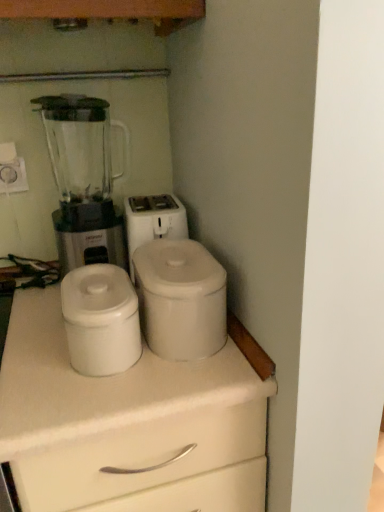
Question: Considering the relative sizes of white matte chest of drawers at center and transparent plastic blender at left in the image provided, is white matte chest of drawers at center thinner than transparent plastic blender at left?

Choices:
 (A) no
 (B) yes

Answer: (A)

Question: From a real-world perspective, is white matte chest of drawers at center positioned under transparent plastic blender at left based on gravity?

Choices:
 (A) no
 (B) yes

Answer: (B)

Question: Is transparent plastic blender at left located within white matte chest of drawers at center?

Choices:
 (A) no
 (B) yes

Answer: (A)

Question: Does white matte chest of drawers at center appear on the right side of transparent plastic blender at left?

Choices:
 (A) no
 (B) yes

Answer: (B)

Question: Is white matte chest of drawers at center bigger than transparent plastic blender at left?

Choices:
 (A) yes
 (B) no

Answer: (A)

Question: Is white matte container at center, which is the first appliance from left to right, spatially inside transparent plastic blender at left, or outside of it?

Choices:
 (A) inside
 (B) outside

Answer: (B)

Question: Considering the positions of white matte container at center, which is the second appliance from right to left, and transparent plastic blender at left in the image, is white matte container at center, which is the second appliance from right to left, bigger or smaller than transparent plastic blender at left?

Choices:
 (A) big
 (B) small

Answer: (B)

Question: Considering the positions of white matte container at center, which is the first appliance from left to right, and transparent plastic blender at left in the image, is white matte container at center, which is the first appliance from left to right, taller or shorter than transparent plastic blender at left?

Choices:
 (A) tall
 (B) short

Answer: (B)

Question: Looking at their shapes, would you say white matte container at center, which is the first appliance from left to right, is wider or thinner than transparent plastic blender at left?

Choices:
 (A) thin
 (B) wide

Answer: (A)

Question: Is point (223, 345) positioned closer to the camera than point (92, 212)?

Choices:
 (A) farther
 (B) closer

Answer: (B)

Question: Is white matte canister at center, positioned as the 2th appliance in left-to-right order, inside or outside of transparent plastic blender at left?

Choices:
 (A) inside
 (B) outside

Answer: (B)

Question: From the image's perspective, is white matte canister at center, arranged as the 1th appliance when viewed from the right, located above or below transparent plastic blender at left?

Choices:
 (A) below
 (B) above

Answer: (A)

Question: Considering the positions of white matte canister at center, positioned as the 2th appliance in left-to-right order, and transparent plastic blender at left in the image, is white matte canister at center, positioned as the 2th appliance in left-to-right order, taller or shorter than transparent plastic blender at left?

Choices:
 (A) tall
 (B) short

Answer: (B)

Question: Considering the positions of point (258, 425) and point (97, 332), is point (258, 425) closer or farther from the camera than point (97, 332)?

Choices:
 (A) farther
 (B) closer

Answer: (A)

Question: From a real-world perspective, is white matte chest of drawers at center physically located above or below white matte container at center, which is the first appliance from left to right?

Choices:
 (A) above
 (B) below

Answer: (B)